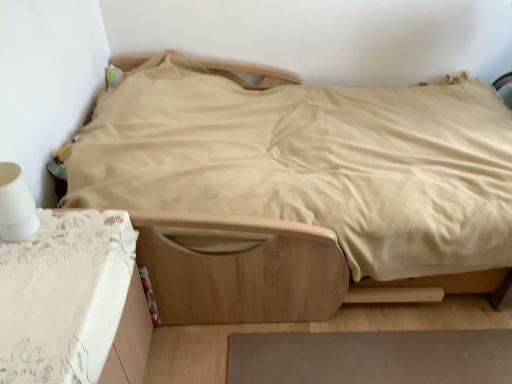
Question: Is brown matte rug at lower center completely or partially outside of light brown wooden bed at center?

Choices:
 (A) no
 (B) yes

Answer: (B)

Question: Is brown matte rug at lower center aimed at light brown wooden bed at center?

Choices:
 (A) yes
 (B) no

Answer: (B)

Question: Considering the relative positions of brown matte rug at lower center and light brown wooden bed at center in the image provided, is brown matte rug at lower center to the right of light brown wooden bed at center from the viewer's perspective?

Choices:
 (A) no
 (B) yes

Answer: (B)

Question: Is brown matte rug at lower center placed right next to light brown wooden bed at center?

Choices:
 (A) no
 (B) yes

Answer: (A)

Question: Considering the relative sizes of brown matte rug at lower center and light brown wooden bed at center in the image provided, is brown matte rug at lower center smaller than light brown wooden bed at center?

Choices:
 (A) yes
 (B) no

Answer: (A)

Question: Considering the relative positions of white lace tablecloth at lower left and light brown wooden bed at center in the image provided, is white lace tablecloth at lower left to the left or to the right of light brown wooden bed at center?

Choices:
 (A) left
 (B) right

Answer: (A)

Question: Is white lace tablecloth at lower left bigger or smaller than light brown wooden bed at center?

Choices:
 (A) small
 (B) big

Answer: (A)

Question: Looking at their shapes, would you say white lace tablecloth at lower left is wider or thinner than light brown wooden bed at center?

Choices:
 (A) wide
 (B) thin

Answer: (B)

Question: Is white lace tablecloth at lower left taller or shorter than light brown wooden bed at center?

Choices:
 (A) short
 (B) tall

Answer: (B)

Question: Would you say light brown wooden bed at center is to the left or to the right of brown matte rug at lower center in the picture?

Choices:
 (A) right
 (B) left

Answer: (B)

Question: Is light brown wooden bed at center inside or outside of brown matte rug at lower center?

Choices:
 (A) inside
 (B) outside

Answer: (B)

Question: In terms of width, does light brown wooden bed at center look wider or thinner when compared to brown matte rug at lower center?

Choices:
 (A) wide
 (B) thin

Answer: (A)

Question: Considering their positions, is light brown wooden bed at center located in front of or behind brown matte rug at lower center?

Choices:
 (A) front
 (B) behind

Answer: (A)

Question: Considering the positions of white lace tablecloth at lower left and white matte table lamp at left in the image, is white lace tablecloth at lower left wider or thinner than white matte table lamp at left?

Choices:
 (A) wide
 (B) thin

Answer: (A)

Question: Considering the positions of white lace tablecloth at lower left and white matte table lamp at left in the image, is white lace tablecloth at lower left taller or shorter than white matte table lamp at left?

Choices:
 (A) tall
 (B) short

Answer: (A)